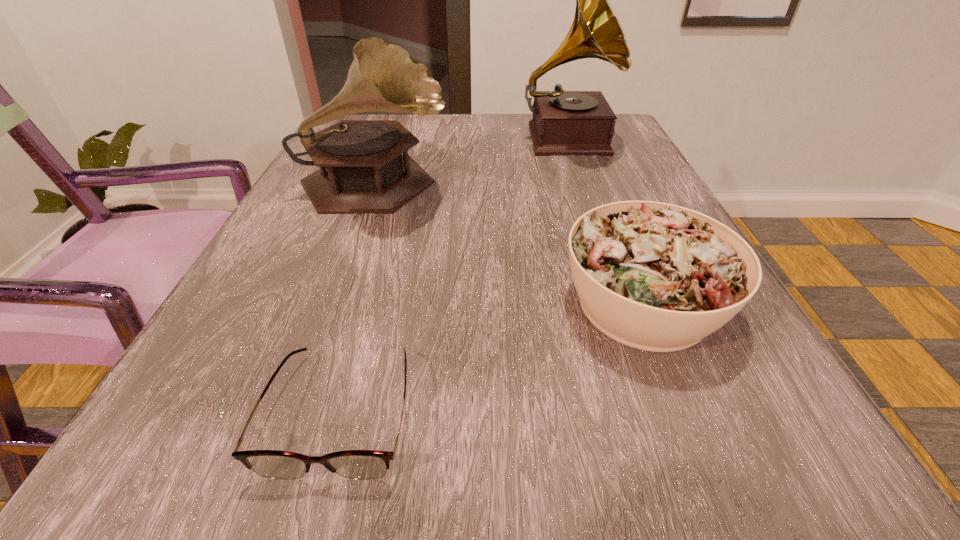
I want to click on object located in the near edge section of the desktop, so click(x=354, y=464).

This screenshot has width=960, height=540. I want to click on phonograph record situated at the left edge, so click(362, 169).

Image resolution: width=960 pixels, height=540 pixels. In order to click on spectacles that is at the left edge in this screenshot , I will do `click(354, 464)`.

Identify the location of phonograph record located at the right edge. (564, 122).

Locate an element on the screen. salad present at the right edge is located at coordinates (658, 277).

The image size is (960, 540). Identify the location of object at the near left corner. (354, 464).

Where is `object at the far right corner`? This screenshot has height=540, width=960. object at the far right corner is located at coordinates (564, 122).

The height and width of the screenshot is (540, 960). What are the coordinates of `free space at the far edge of the desktop` in the screenshot? It's located at (456, 118).

Find the location of a particular element. The image size is (960, 540). free space at the near edge of the desktop is located at coordinates (467, 448).

Locate an element on the screen. The height and width of the screenshot is (540, 960). free space at the left edge is located at coordinates (291, 302).